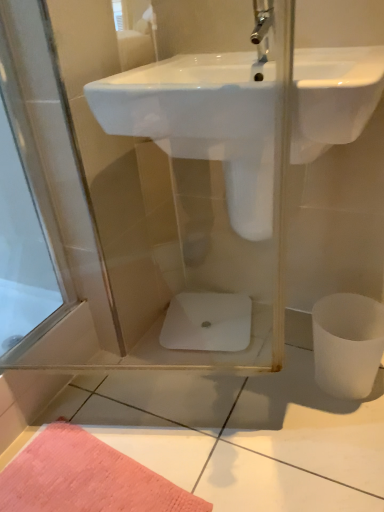
What is the approximate width of white matte toilet bowl at lower right, which is counted as the 1th toilet bowl, starting from the front?

The width of white matte toilet bowl at lower right, which is counted as the 1th toilet bowl, starting from the front, is 21.93 centimeters.

Find the location of `white matte toilet bowl at lower right, marked as the 2th toilet bowl in a back-to-front arrangement`. white matte toilet bowl at lower right, marked as the 2th toilet bowl in a back-to-front arrangement is located at coordinates (347, 344).

From the image's perspective, is white glossy sink at center below white glossy toilet bowl at center, the first toilet bowl in the left-to-right sequence?

No, from the image's perspective, white glossy sink at center is not beneath white glossy toilet bowl at center, the first toilet bowl in the left-to-right sequence.

There is a white glossy sink at center. Identify the location of the 2nd toilet bowl below it (from a real-world perspective). (207, 322).

In the scene shown: Does white glossy sink at center appear on the right side of white glossy toilet bowl at center, marked as the 2th toilet bowl in a front-to-back arrangement?

Correct, you'll find white glossy sink at center to the right of white glossy toilet bowl at center, marked as the 2th toilet bowl in a front-to-back arrangement.

What's the angular difference between white glossy sink at center and white glossy toilet bowl at center, marked as the 2th toilet bowl in a front-to-back arrangement,'s facing directions?

The facing directions of white glossy sink at center and white glossy toilet bowl at center, marked as the 2th toilet bowl in a front-to-back arrangement, are 17.8 degrees apart.

Is white glossy toilet bowl at center, the first toilet bowl when ordered from back to front, positioned far away from white matte toilet bowl at lower right, the second toilet bowl when ordered from left to right?

No, white glossy toilet bowl at center, the first toilet bowl when ordered from back to front, is not far away from white matte toilet bowl at lower right, the second toilet bowl when ordered from left to right.

Is white glossy toilet bowl at center, which is counted as the 2th toilet bowl, starting from the right, to the left or to the right of white matte toilet bowl at lower right, the second toilet bowl when ordered from left to right, in the image?

From the image, it's evident that white glossy toilet bowl at center, which is counted as the 2th toilet bowl, starting from the right, is to the left of white matte toilet bowl at lower right, the second toilet bowl when ordered from left to right.

How distant is white glossy toilet bowl at center, the first toilet bowl when ordered from back to front, from white matte toilet bowl at lower right, which ranks as the 1th toilet bowl in right-to-left order?

white glossy toilet bowl at center, the first toilet bowl when ordered from back to front, is 13.23 inches away from white matte toilet bowl at lower right, which ranks as the 1th toilet bowl in right-to-left order.

Is white matte toilet bowl at lower right, which ranks as the 1th toilet bowl in right-to-left order, at the back of white glossy toilet bowl at center, the first toilet bowl when ordered from back to front?

white glossy toilet bowl at center, the first toilet bowl when ordered from back to front, is not turned away from white matte toilet bowl at lower right, which ranks as the 1th toilet bowl in right-to-left order.

Looking at this image, is white glossy toilet bowl at center, the first toilet bowl when ordered from back to front, situated inside white glossy sink at center or outside?

white glossy toilet bowl at center, the first toilet bowl when ordered from back to front, exists outside the volume of white glossy sink at center.

Image resolution: width=384 pixels, height=512 pixels. Find the location of `sink to the right of white glossy toilet bowl at center, marked as the 2th toilet bowl in a front-to-back arrangement`. sink to the right of white glossy toilet bowl at center, marked as the 2th toilet bowl in a front-to-back arrangement is located at coordinates (194, 106).

Considering the positions of objects white glossy toilet bowl at center, the first toilet bowl when ordered from back to front, and white glossy sink at center in the image provided, who is more to the right, white glossy toilet bowl at center, the first toilet bowl when ordered from back to front, or white glossy sink at center?

From the viewer's perspective, white glossy sink at center appears more on the right side.

Looking at this image, does white matte toilet bowl at lower right, which ranks as the 1th toilet bowl in right-to-left order, come in front of white glossy toilet bowl at center, marked as the 2th toilet bowl in a front-to-back arrangement?

Yes.

Considering the relative sizes of white matte toilet bowl at lower right, marked as the 2th toilet bowl in a back-to-front arrangement, and white glossy toilet bowl at center, the first toilet bowl when ordered from back to front, in the image provided, is white matte toilet bowl at lower right, marked as the 2th toilet bowl in a back-to-front arrangement, wider than white glossy toilet bowl at center, the first toilet bowl when ordered from back to front,?

No.

Looking at this image, is white matte toilet bowl at lower right, which ranks as the 1th toilet bowl in right-to-left order, inside the boundaries of white glossy toilet bowl at center, which is counted as the 2th toilet bowl, starting from the right, or outside?

white matte toilet bowl at lower right, which ranks as the 1th toilet bowl in right-to-left order, is not inside white glossy toilet bowl at center, which is counted as the 2th toilet bowl, starting from the right, it's outside.

Based on their sizes in the image, would you say white matte toilet bowl at lower right, which ranks as the 1th toilet bowl in right-to-left order, is bigger or smaller than white glossy toilet bowl at center, which is counted as the 2th toilet bowl, starting from the right?

white matte toilet bowl at lower right, which ranks as the 1th toilet bowl in right-to-left order, is bigger than white glossy toilet bowl at center, which is counted as the 2th toilet bowl, starting from the right.

Measure the distance between white glossy sink at center and white matte toilet bowl at lower right, marked as the 2th toilet bowl in a back-to-front arrangement.

white glossy sink at center is 59.34 centimeters away from white matte toilet bowl at lower right, marked as the 2th toilet bowl in a back-to-front arrangement.

This screenshot has width=384, height=512. What are the coordinates of `sink on the left side of white matte toilet bowl at lower right, which ranks as the 1th toilet bowl in right-to-left order` in the screenshot? It's located at (194, 106).

Is white glossy sink at center thinner than white matte toilet bowl at lower right, which is counted as the 1th toilet bowl, starting from the front?

No, white glossy sink at center is not thinner than white matte toilet bowl at lower right, which is counted as the 1th toilet bowl, starting from the front.

From the image's perspective, is white glossy sink at center above or below white matte toilet bowl at lower right, which is counted as the 1th toilet bowl, starting from the front?

white glossy sink at center is above white matte toilet bowl at lower right, which is counted as the 1th toilet bowl, starting from the front.

What's the angular difference between white matte toilet bowl at lower right, which is counted as the 1th toilet bowl, starting from the front, and white glossy sink at center's facing directions?

Result: There is a 0.53-degree angle between the facing directions of white matte toilet bowl at lower right, which is counted as the 1th toilet bowl, starting from the front, and white glossy sink at center.

Does white matte toilet bowl at lower right, which ranks as the 1th toilet bowl in right-to-left order, lie behind white glossy sink at center?

Yes.

Does white matte toilet bowl at lower right, the second toilet bowl when ordered from left to right, have a lesser height compared to white glossy sink at center?

No, white matte toilet bowl at lower right, the second toilet bowl when ordered from left to right, is not shorter than white glossy sink at center.

Is white matte toilet bowl at lower right, which is counted as the 1th toilet bowl, starting from the front, aimed at white glossy sink at center?

No.

Where is `sink above the white glossy toilet bowl at center, marked as the 2th toilet bowl in a front-to-back arrangement (from the image's perspective)`? sink above the white glossy toilet bowl at center, marked as the 2th toilet bowl in a front-to-back arrangement (from the image's perspective) is located at coordinates (194, 106).

Where is `toilet bowl behind the white matte toilet bowl at lower right, the second toilet bowl when ordered from left to right`? Image resolution: width=384 pixels, height=512 pixels. toilet bowl behind the white matte toilet bowl at lower right, the second toilet bowl when ordered from left to right is located at coordinates (207, 322).

Considering their positions, is white glossy sink at center positioned closer to white glossy toilet bowl at center, which is counted as the 2th toilet bowl, starting from the right, than white matte toilet bowl at lower right, marked as the 2th toilet bowl in a back-to-front arrangement?

The object closer to white glossy toilet bowl at center, which is counted as the 2th toilet bowl, starting from the right, is white matte toilet bowl at lower right, marked as the 2th toilet bowl in a back-to-front arrangement.

From the image, which object appears to be farther from white glossy sink at center, white matte toilet bowl at lower right, the second toilet bowl when ordered from left to right, or white glossy toilet bowl at center, the first toilet bowl in the left-to-right sequence?

white glossy toilet bowl at center, the first toilet bowl in the left-to-right sequence, is positioned further to the anchor white glossy sink at center.

Based on their spatial positions, is white glossy sink at center or white glossy toilet bowl at center, the first toilet bowl in the left-to-right sequence, further from white matte toilet bowl at lower right, the second toilet bowl when ordered from left to right?

The object further to white matte toilet bowl at lower right, the second toilet bowl when ordered from left to right, is white glossy sink at center.

From the image, which object appears to be nearer to white matte toilet bowl at lower right, which is counted as the 1th toilet bowl, starting from the front, white glossy toilet bowl at center, the first toilet bowl when ordered from back to front, or white glossy sink at center?

white glossy toilet bowl at center, the first toilet bowl when ordered from back to front.

Based on their spatial positions, is white matte toilet bowl at lower right, which is counted as the 1th toilet bowl, starting from the front, or white glossy sink at center closer to white glossy toilet bowl at center, marked as the 2th toilet bowl in a front-to-back arrangement?

The object closer to white glossy toilet bowl at center, marked as the 2th toilet bowl in a front-to-back arrangement, is white matte toilet bowl at lower right, which is counted as the 1th toilet bowl, starting from the front.

When comparing their distances from white glossy sink at center, does white glossy toilet bowl at center, which is counted as the 2th toilet bowl, starting from the right, or white matte toilet bowl at lower right, which is counted as the 1th toilet bowl, starting from the front, seem closer?

white matte toilet bowl at lower right, which is counted as the 1th toilet bowl, starting from the front, lies closer to white glossy sink at center than the other object.

You are a GUI agent. You are given a task and a screenshot of the screen. Output one action in this format:
    pyautogui.click(x=<x>, y=<y>)
    Task: Click on the toilet bowl positioned between white glossy sink at center and white glossy toilet bowl at center, marked as the 2th toilet bowl in a front-to-back arrangement, from near to far
    The image size is (384, 512).
    Given the screenshot: What is the action you would take?
    pyautogui.click(x=347, y=344)